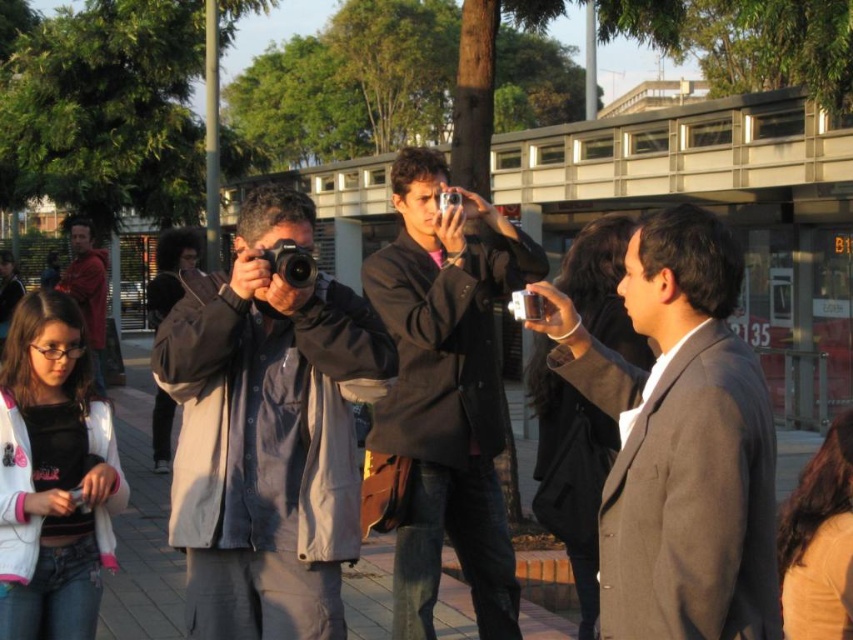
Measure the distance from dark brown leather jacket at center to metallic silver camera at center.

A distance of 4.37 feet exists between dark brown leather jacket at center and metallic silver camera at center.

Can you confirm if dark brown leather jacket at center is positioned to the left of metallic silver camera at center?

Indeed, dark brown leather jacket at center is positioned on the left side of metallic silver camera at center.

The image size is (853, 640). What do you see at coordinates (444, 397) in the screenshot?
I see `dark brown leather jacket at center` at bounding box center [444, 397].

You are a GUI agent. You are given a task and a screenshot of the screen. Output one action in this format:
    pyautogui.click(x=<x>, y=<y>)
    Task: Click on the dark brown leather jacket at center
    The image size is (853, 640).
    Given the screenshot: What is the action you would take?
    pyautogui.click(x=444, y=397)

Does gray woolen suit at right lie behind silver metallic camera at center?

No, gray woolen suit at right is closer to the viewer.

Find the location of a particular element. The image size is (853, 640). gray woolen suit at right is located at coordinates (694, 502).

Who is more forward, (598, 561) or (442, 193)?

Point (598, 561) is in front.

Locate an element on the screen. The image size is (853, 640). gray woolen suit at right is located at coordinates (694, 502).

Between gray woolen suit at right and metallic silver camera at center, which one appears on the left side from the viewer's perspective?

From the viewer's perspective, metallic silver camera at center appears more on the left side.

Looking at this image, who is taller, gray woolen suit at right or metallic silver camera at center?

gray woolen suit at right

Find the location of a particular element. Image resolution: width=853 pixels, height=640 pixels. gray woolen suit at right is located at coordinates (694, 502).